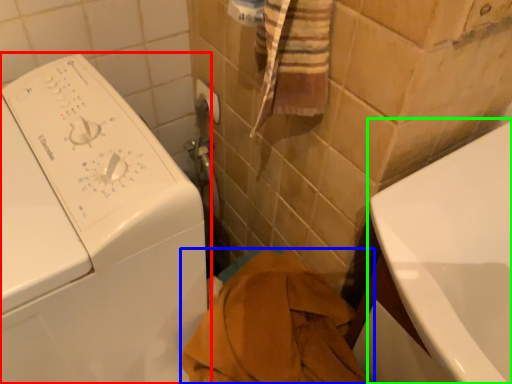
Question: Which object is the farthest from washing machine (highlighted by a red box)? Choose among these: bath towel (highlighted by a blue box) or bath (highlighted by a green box).

Choices:
 (A) bath towel
 (B) bath

Answer: (B)